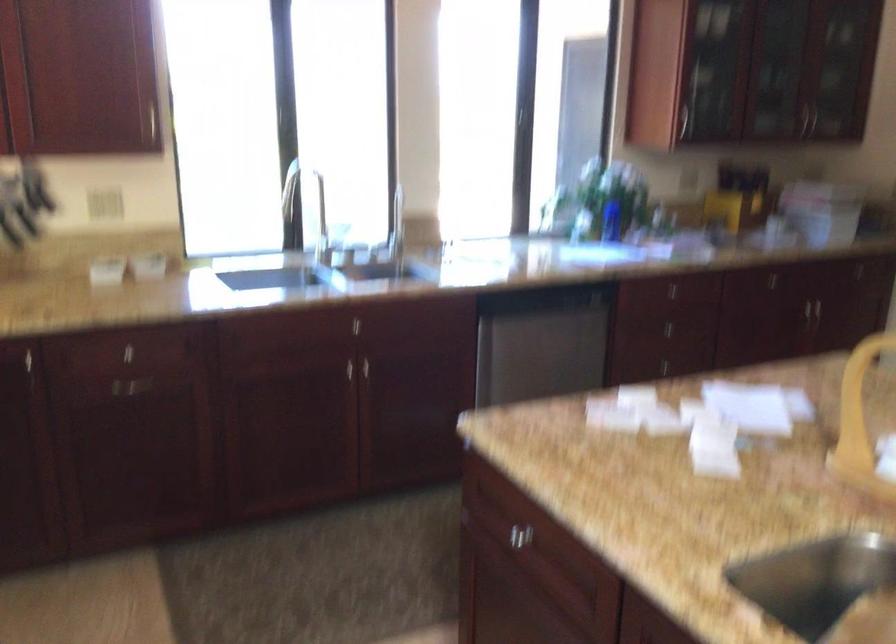
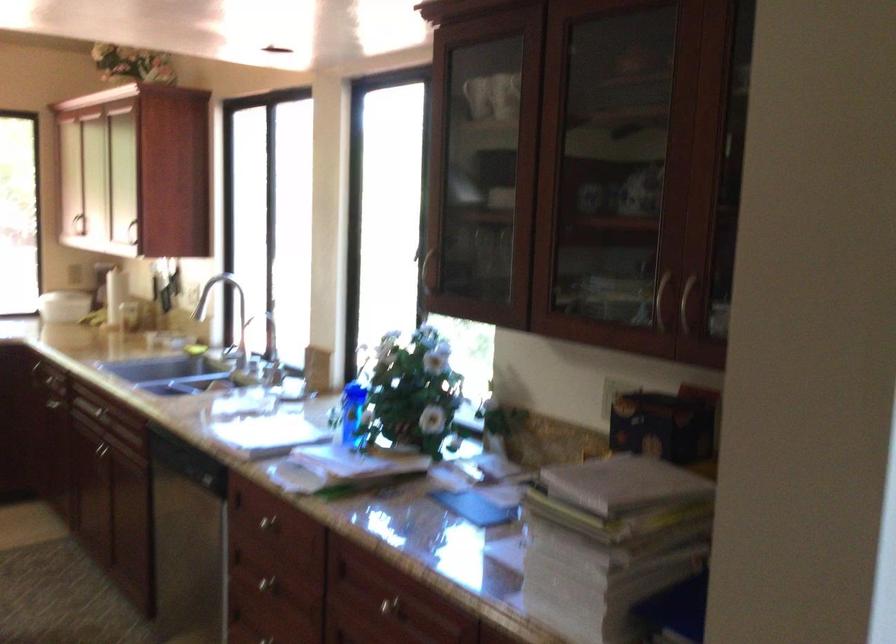
Where in the second image is the point corresponding to (712,156) from the first image?

(614, 393)